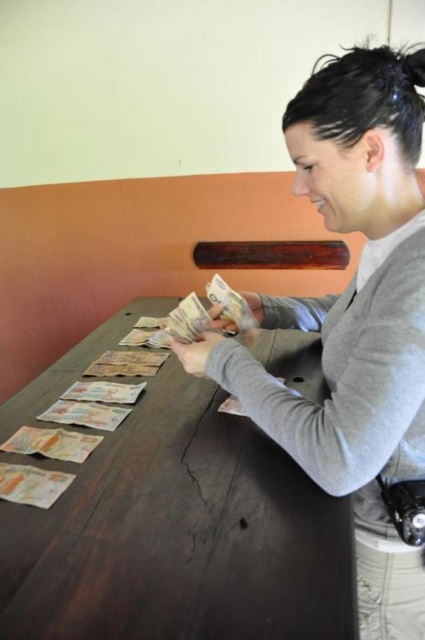
You are a photographer who needs to take a closeup shot of the dark brown wood table at center. You have a camera with a minimum focusing distance of 10 inches. Can you take the photo without moving either the camera or the gray matte sweater at center?

The dark brown wood table at center is 10.08 inches from gray matte sweater at center. Since the minimum focusing distance is 10 inches, the photographer can take the photo as the distance is just slightly over the required minimum.

You are a photographer trying to capture a closeup of the woman counting money. You notice two points marked in the image. Which point, point (x=115, y=592) or point (x=419, y=100), is closer to you and would allow for a better closeup shot?

Point (x=115, y=592) is closer to the viewer than point (x=419, y=100), so it would allow for a better closeup shot.

Consider the image. You are a photographer who wants to take a closeup shot of the dark brown wood table at center and the gray matte sweater at center. Given that your camera lens can only focus on objects within a 1.2 meter width, will both objects fit within the frame?

The dark brown wood table at center is wider than the gray matte sweater at center. Since the camera lens can focus on objects within 1.2 meters width, both objects can fit within the frame as long as their combined width does not exceed 1.2 meters. However, the description only states the table is wider than the sweater but does not provide exact measurements, so it is uncertain if they will fit together.